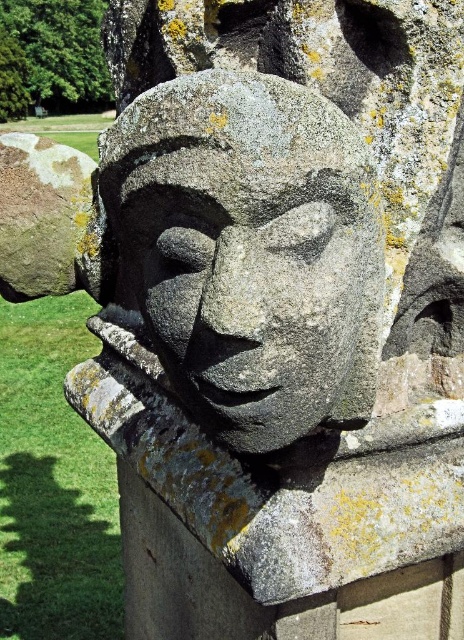
Question: Is gray stone face at center bigger than speckled gray rock at upper left?

Choices:
 (A) no
 (B) yes

Answer: (B)

Question: Which object is closer to the camera taking this photo?

Choices:
 (A) speckled gray rock at upper left
 (B) gray stone face at center

Answer: (B)

Question: Is gray stone face at center smaller than speckled gray rock at upper left?

Choices:
 (A) yes
 (B) no

Answer: (B)

Question: Can you confirm if gray stone face at center is positioned above speckled gray rock at upper left?

Choices:
 (A) no
 (B) yes

Answer: (A)